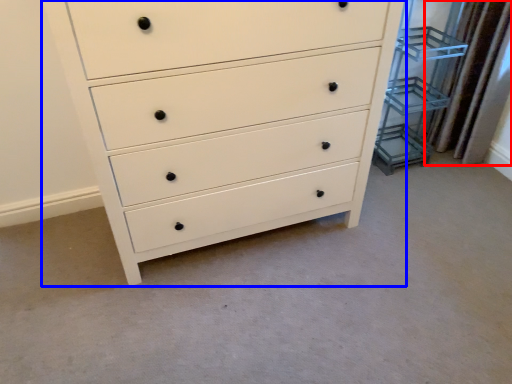
Question: Which of the following is the closest to the observer, curtain (highlighted by a red box) or chest of drawers (highlighted by a blue box)?

Choices:
 (A) curtain
 (B) chest of drawers

Answer: (B)